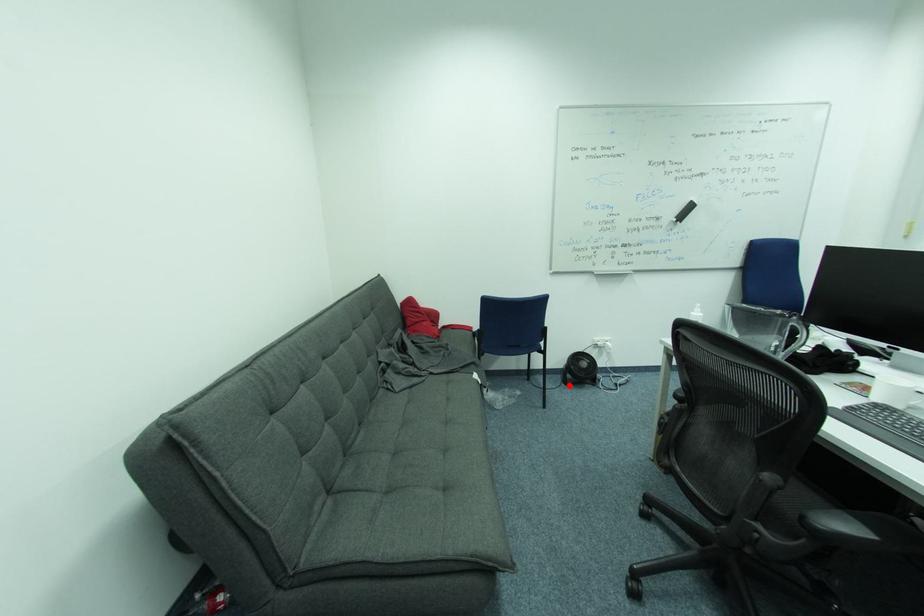
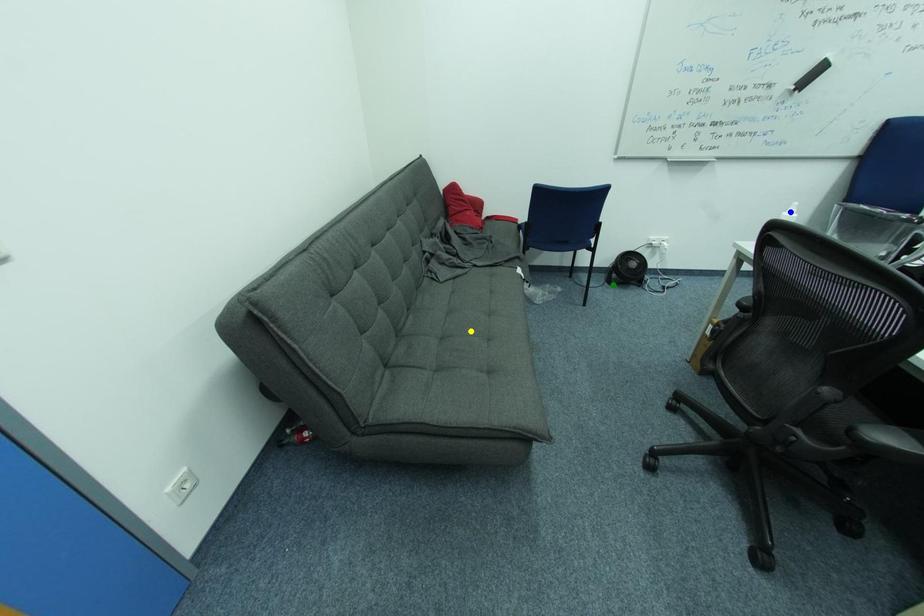
Question: I am providing you with two images of the same scene from different viewpoints. A red point is marked on the first image. You are given multiple points on the second image. Which point in image 2 represents the same 3d spot as the red point in image 1?

Choices:
 (A) green point
 (B) blue point
 (C) yellow point

Answer: (A)